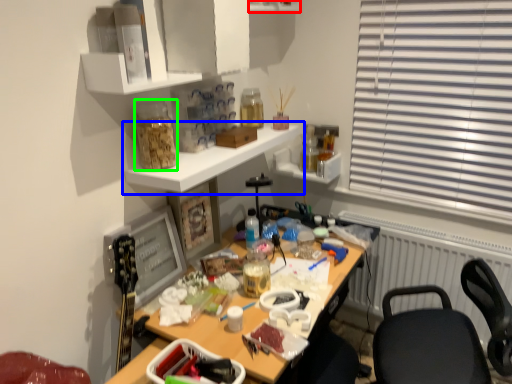
Question: Based on their relative distances, which object is nearer to shelf (highlighted by a red box)? Choose from shelf (highlighted by a blue box) and bottle (highlighted by a green box).

Choices:
 (A) shelf
 (B) bottle

Answer: (A)